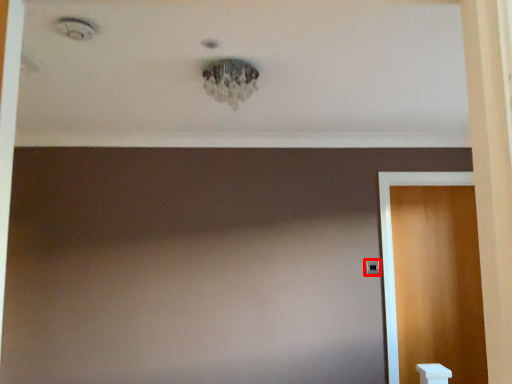
Question: From the image's perspective, where is door handle (annotated by the red box) located in relation to door in the image?

Choices:
 (A) above
 (B) below

Answer: (A)